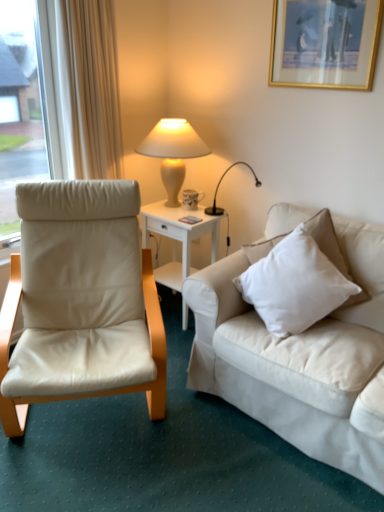
Question: Should I look upward or downward to see white glossy side table at center?

Choices:
 (A) down
 (B) up

Answer: (A)

Question: Is beige leather chair at left to the right of white glossy side table at center from the viewer's perspective?

Choices:
 (A) no
 (B) yes

Answer: (A)

Question: Can you confirm if beige leather chair at left is positioned to the left of white glossy side table at center?

Choices:
 (A) no
 (B) yes

Answer: (B)

Question: Is beige leather chair at left closer to camera compared to white glossy side table at center?

Choices:
 (A) no
 (B) yes

Answer: (B)

Question: Are beige leather chair at left and white glossy side table at center located far from each other?

Choices:
 (A) no
 (B) yes

Answer: (A)

Question: Is beige leather chair at left positioned behind white glossy side table at center?

Choices:
 (A) yes
 (B) no

Answer: (B)

Question: Is beige leather chair at left wider than white glossy side table at center?

Choices:
 (A) yes
 (B) no

Answer: (A)

Question: From a real-world perspective, is white glossy side table at center located higher than gold-framed picture at upper right?

Choices:
 (A) no
 (B) yes

Answer: (A)

Question: From the image's perspective, is white glossy side table at center under gold-framed picture at upper right?

Choices:
 (A) no
 (B) yes

Answer: (B)

Question: Is the position of white glossy side table at center more distant than that of gold-framed picture at upper right?

Choices:
 (A) yes
 (B) no

Answer: (A)

Question: Is white glossy side table at center in contact with gold-framed picture at upper right?

Choices:
 (A) no
 (B) yes

Answer: (A)

Question: Is white glossy side table at center at the right side of gold-framed picture at upper right?

Choices:
 (A) no
 (B) yes

Answer: (A)

Question: Does white glossy side table at center have a greater height compared to gold-framed picture at upper right?

Choices:
 (A) no
 (B) yes

Answer: (B)

Question: Is white cotton pillow at right in contact with gold-framed picture at upper right?

Choices:
 (A) yes
 (B) no

Answer: (B)